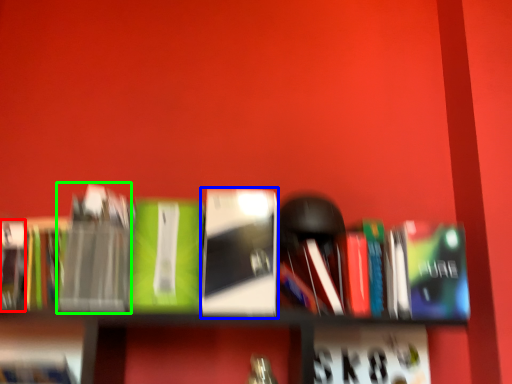
Question: Based on their relative distances, which object is nearer to paperback book (highlighted by a red box)? Choose from book (highlighted by a blue box) and paperback book (highlighted by a green box).

Choices:
 (A) book
 (B) paperback book

Answer: (B)